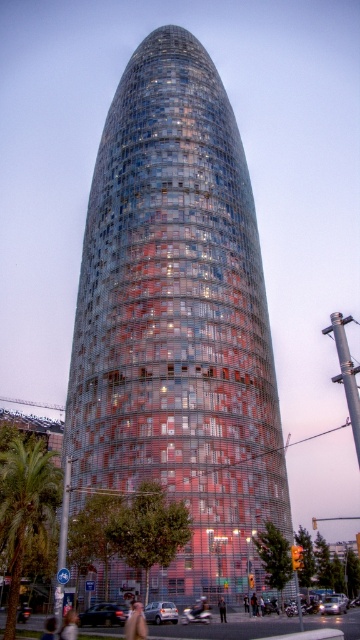
You are standing at the base of the Torre Agbar in Barcelona. You see the green leafy palm tree at lower left. If you were to walk directly towards the palm tree, would you be moving north, south, east, or west?

Since the green leafy palm tree at lower left is located at point (x=24, y=509), which is in the lower left corner of the image, walking directly towards it would mean moving west and south from your current position at the base of the tower.

You are standing at the base of the Torre Agbar in Barcelona. You notice a point marked at coordinates (177, 321). Based on the scene description, what does this point most likely represent?

The point at (177, 321) most likely represents the glassy steel tower at center, as the description states that this point indicates the tower.

You are standing at the origin point of the coordinate system. You want to walk towards the glassy steel tower at center. Which direction should you move in?

Since the glassy steel tower at center is located at coordinate point (x=177, y=321), you should move towards the center of the scene to reach it.